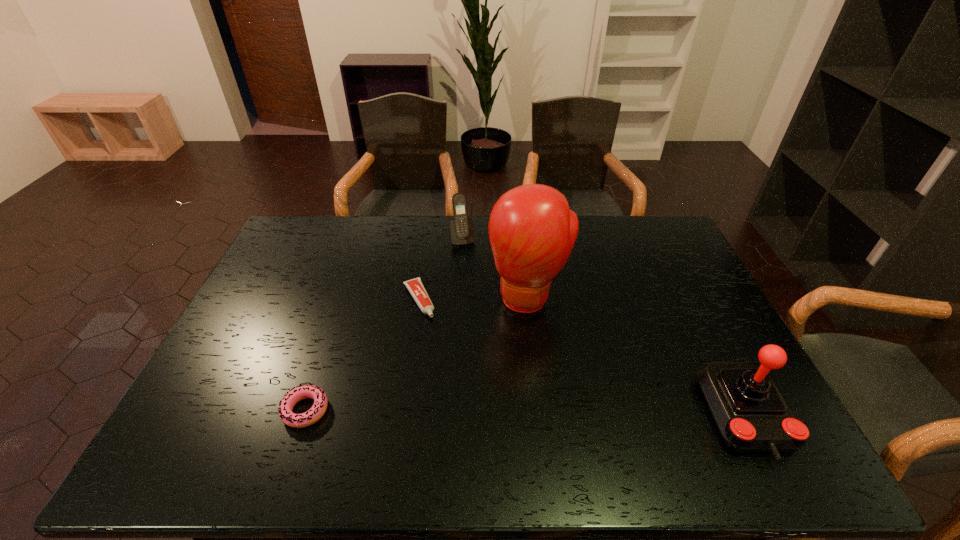
The height and width of the screenshot is (540, 960). Identify the location of vacant space on the desktop that is between the doughnut and the fourth shortest object and is positioned at the nozzle of the second object from left to right. (481, 413).

The height and width of the screenshot is (540, 960). What are the coordinates of `free spot on the desktop that is between the doughnut and the rightmost object and is positioned on the front-facing side of the cellular telephone` in the screenshot? It's located at (516, 413).

Locate an element on the screen. The image size is (960, 540). vacant spot on the desktop that is between the leftmost object and the joystick and is positioned on the striking surface of the boxing glove is located at coordinates (507, 413).